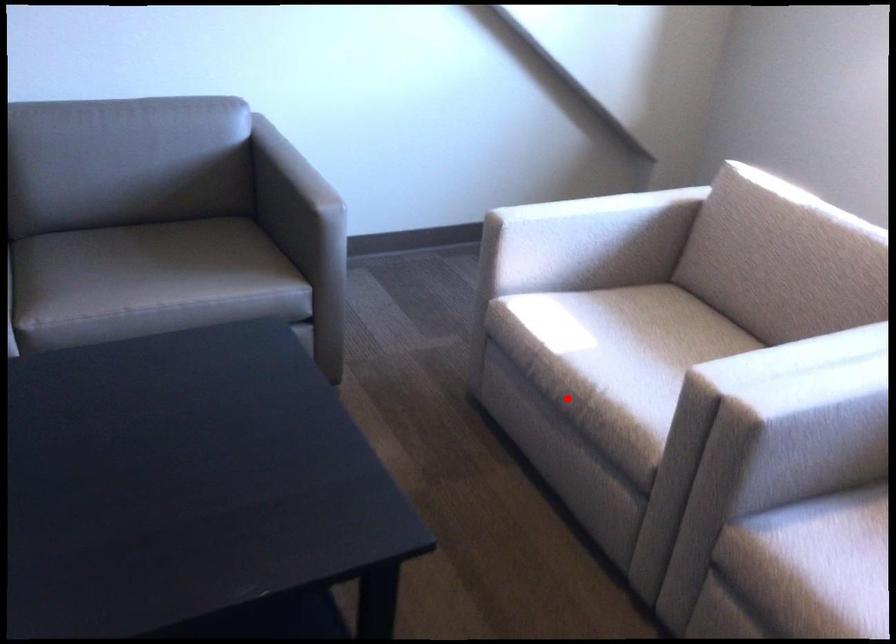
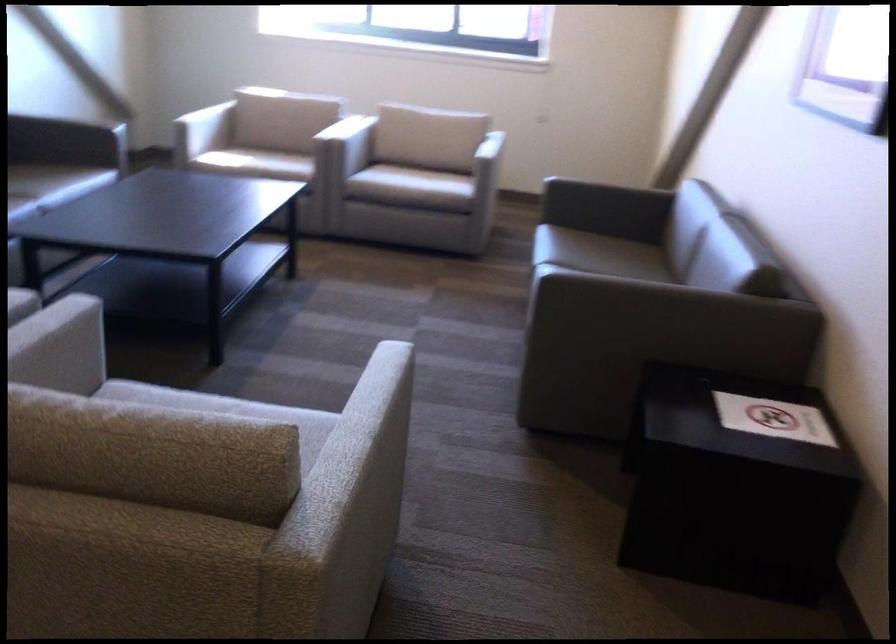
In the second image, find the point that corresponds to the highlighted location in the first image.

(255, 163)